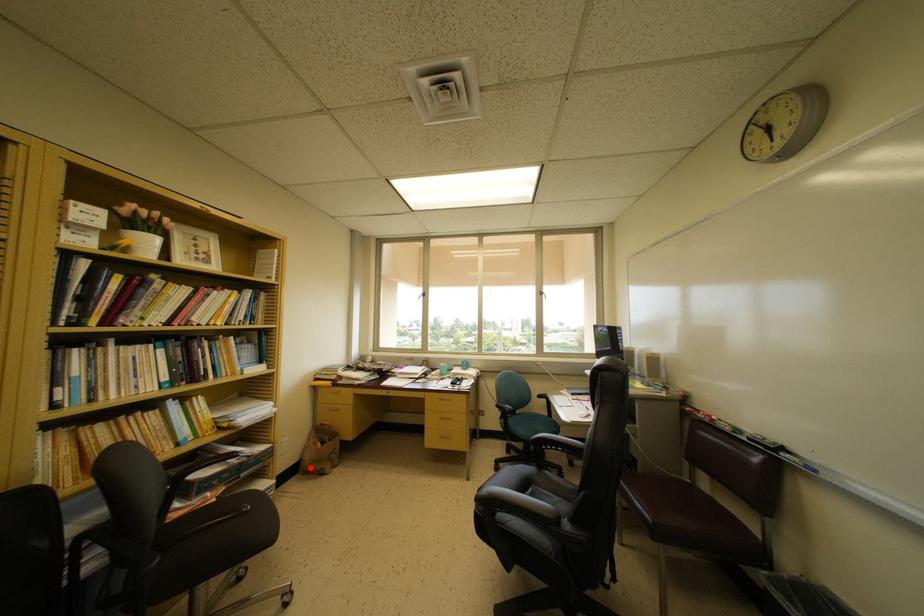
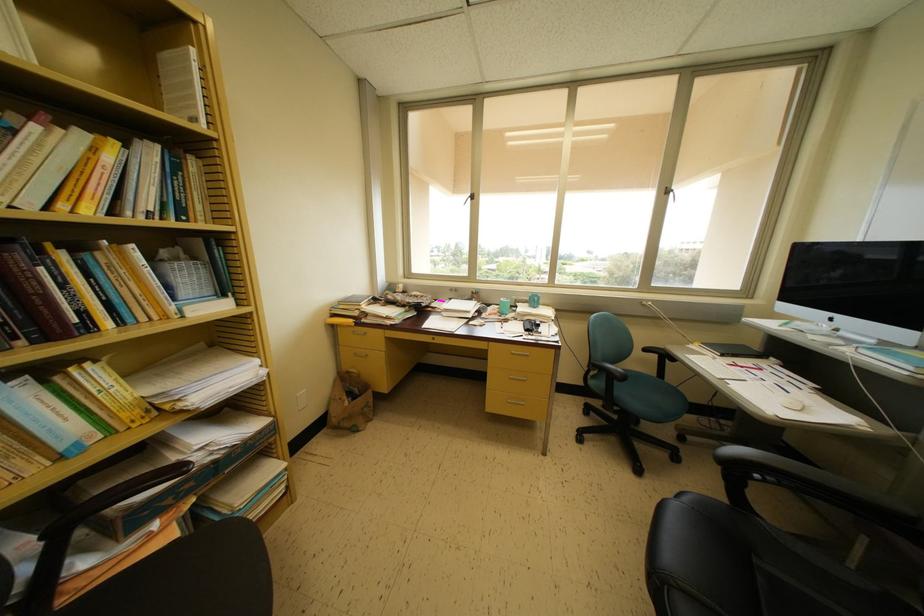
Question: I am providing you with two images of the same scene from different viewpoints. Given a red point in image1, look at the same physical point in image2. Is it:

Choices:
 (A) Closer to the viewpoint
 (B) Farther from the viewpoint

Answer: (A)